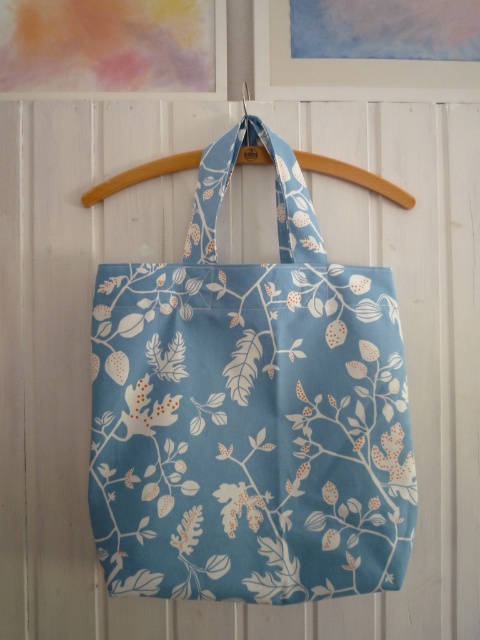
Question: Which object is farther from the camera taking this photo?

Choices:
 (A) light blue fabric tote at center
 (B) wooden hanger at center

Answer: (B)

Question: Can you confirm if light blue fabric tote at center is positioned to the left of wooden hanger at center?

Choices:
 (A) yes
 (B) no

Answer: (A)

Question: Which of the following is the farthest from the observer?

Choices:
 (A) light blue fabric tote at center
 (B) wooden hanger at center

Answer: (B)

Question: Observing the image, what is the correct spatial positioning of light blue fabric tote at center in reference to wooden hanger at center?

Choices:
 (A) right
 (B) left

Answer: (B)

Question: Considering the relative positions of light blue fabric tote at center and wooden hanger at center in the image provided, where is light blue fabric tote at center located with respect to wooden hanger at center?

Choices:
 (A) above
 (B) below

Answer: (B)